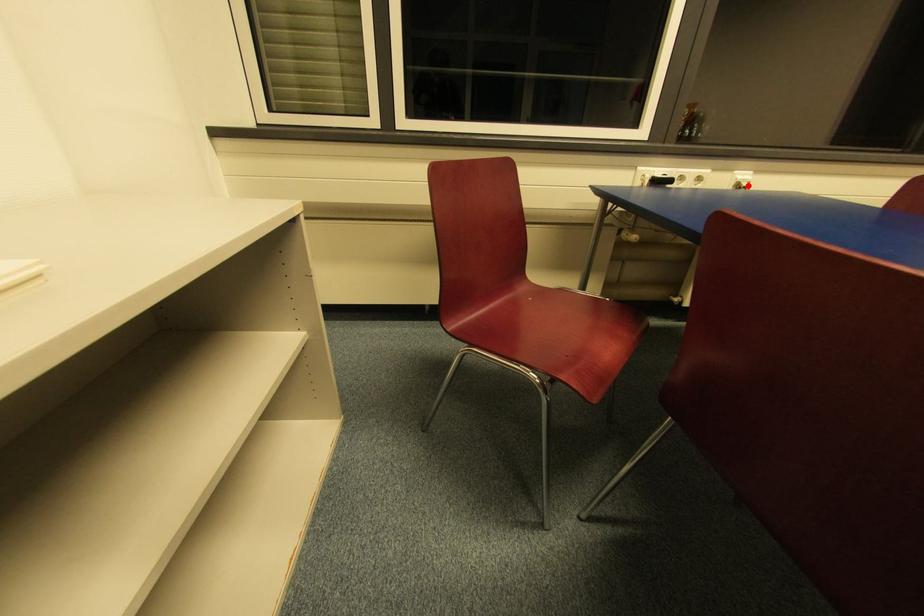
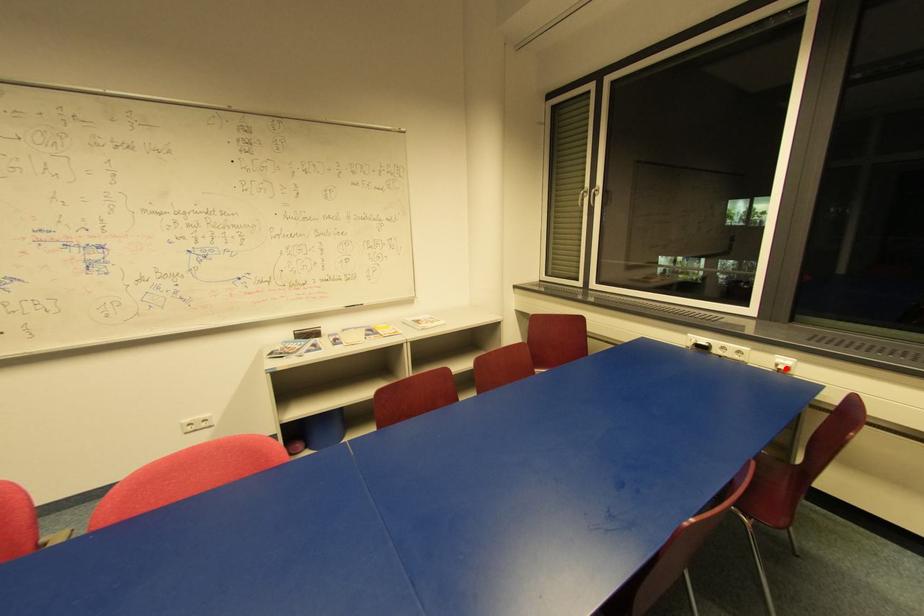
I am providing you with two images of the same scene from different viewpoints. A red point is marked on the first image and another point is marked on the second image. Is the marked point in image1 the same physical position as the marked point in image2?

Yes